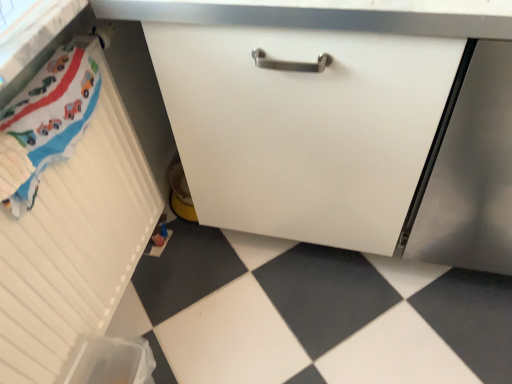
What do you see at coordinates (309, 310) in the screenshot? I see `white glossy tile at lower left` at bounding box center [309, 310].

The width and height of the screenshot is (512, 384). What do you see at coordinates (343, 120) in the screenshot?
I see `white matte cabinet at center, which appears as the 2th cabinetry when viewed from the left` at bounding box center [343, 120].

What do you see at coordinates (469, 171) in the screenshot?
I see `satin silver screen door at lower right` at bounding box center [469, 171].

Locate an element on the screen. white glossy tile at lower left is located at coordinates (309, 310).

Considering the relative sizes of white matte cabinet at center, which ranks as the 1th cabinetry in right-to-left order, and white glossy tile at lower left in the image provided, is white matte cabinet at center, which ranks as the 1th cabinetry in right-to-left order, taller than white glossy tile at lower left?

Indeed, white matte cabinet at center, which ranks as the 1th cabinetry in right-to-left order, has a greater height compared to white glossy tile at lower left.

Between white matte cabinet at center, which ranks as the 1th cabinetry in right-to-left order, and white glossy tile at lower left, which one is positioned behind?

white glossy tile at lower left is further from the camera.

What's the angular difference between white matte cabinet at center, which ranks as the 1th cabinetry in right-to-left order, and white glossy tile at lower left's facing directions?

The angle between the facing direction of white matte cabinet at center, which ranks as the 1th cabinetry in right-to-left order, and the facing direction of white glossy tile at lower left is 89.5 degrees.

From a real-world perspective, is white matte cabinet at center, which ranks as the 1th cabinetry in right-to-left order, under white glossy tile at lower left?

Actually, white matte cabinet at center, which ranks as the 1th cabinetry in right-to-left order, is physically above white glossy tile at lower left in the real world.

From the image's perspective, relative to white matte cabinet at center, which appears as the 2th cabinetry when viewed from the left, is white glossy tile at lower left above or below?

white glossy tile at lower left is situated lower than white matte cabinet at center, which appears as the 2th cabinetry when viewed from the left, in the image.

Can you confirm if white glossy tile at lower left is shorter than white matte cabinet at center, which appears as the 2th cabinetry when viewed from the left?

Yes.

Does white glossy tile at lower left come in front of white matte cabinet at center, which appears as the 2th cabinetry when viewed from the left?

No, white glossy tile at lower left is further to the viewer.

Is white matte cabinet at center, which appears as the 2th cabinetry when viewed from the left, a part of white glossy tile at lower left?

That's incorrect, white matte cabinet at center, which appears as the 2th cabinetry when viewed from the left, is not inside white glossy tile at lower left.

Does point (14, 247) lie behind point (153, 301)?

No, it is not.

From a real-world perspective, is white matte radiator at left, the second cabinetry when ordered from right to left, positioned under white glossy tile at lower left based on gravity?

No.

Is white matte radiator at left, which is the first cabinetry from left to right, inside or outside of white glossy tile at lower left?

white matte radiator at left, which is the first cabinetry from left to right, lies outside white glossy tile at lower left.

Considering the relative sizes of white matte cabinet at center, which ranks as the 1th cabinetry in right-to-left order, and white matte radiator at left, which is the first cabinetry from left to right, in the image provided, is white matte cabinet at center, which ranks as the 1th cabinetry in right-to-left order, shorter than white matte radiator at left, which is the first cabinetry from left to right,?

Incorrect, the height of white matte cabinet at center, which ranks as the 1th cabinetry in right-to-left order, does not fall short of that of white matte radiator at left, which is the first cabinetry from left to right.

From a real-world perspective, between white matte cabinet at center, which appears as the 2th cabinetry when viewed from the left, and white matte radiator at left, the second cabinetry when ordered from right to left, who is vertically lower?

white matte radiator at left, the second cabinetry when ordered from right to left, from a real-world perspective.

In the image, is white matte cabinet at center, which appears as the 2th cabinetry when viewed from the left, positioned in front of or behind white matte radiator at left, which is the first cabinetry from left to right?

Visually, white matte cabinet at center, which appears as the 2th cabinetry when viewed from the left, is located behind white matte radiator at left, which is the first cabinetry from left to right.

Between white matte cabinet at center, which ranks as the 1th cabinetry in right-to-left order, and white matte radiator at left, which is the first cabinetry from left to right, which one appears on the left side from the viewer's perspective?

From the viewer's perspective, white matte radiator at left, which is the first cabinetry from left to right, appears more on the left side.

This screenshot has height=384, width=512. Identify the location of screen door that is on the right side of white glossy tile at lower left. (469, 171).

Is white glossy tile at lower left not inside satin silver screen door at lower right?

Yes, white glossy tile at lower left is outside of satin silver screen door at lower right.

Looking at this image, which object is positioned more to the right, white glossy tile at lower left or satin silver screen door at lower right?

From the viewer's perspective, satin silver screen door at lower right appears more on the right side.

Which of these two, white glossy tile at lower left or white matte radiator at left, the second cabinetry when ordered from right to left, is wider?

Wider between the two is white glossy tile at lower left.

Is point (392, 367) in front of point (147, 100)?

Yes, point (392, 367) is closer to viewer.

Is white glossy tile at lower left positioned far away from white matte radiator at left, the second cabinetry when ordered from right to left?

No, white glossy tile at lower left is not far from white matte radiator at left, the second cabinetry when ordered from right to left.

Is white matte radiator at left, the second cabinetry when ordered from right to left, positioned with its back to satin silver screen door at lower right?

No, satin silver screen door at lower right is not at the back of white matte radiator at left, the second cabinetry when ordered from right to left.

Based on their positions, is white matte radiator at left, the second cabinetry when ordered from right to left, located to the left or right of satin silver screen door at lower right?

From the image, it's evident that white matte radiator at left, the second cabinetry when ordered from right to left, is to the left of satin silver screen door at lower right.

Which is behind, white matte radiator at left, which is the first cabinetry from left to right, or satin silver screen door at lower right?

satin silver screen door at lower right is behind.

Who is smaller, white matte radiator at left, the second cabinetry when ordered from right to left, or satin silver screen door at lower right?

white matte radiator at left, the second cabinetry when ordered from right to left, is smaller.

Where is `tile below the white matte cabinet at center, which ranks as the 1th cabinetry in right-to-left order (from a real-world perspective)`? The width and height of the screenshot is (512, 384). tile below the white matte cabinet at center, which ranks as the 1th cabinetry in right-to-left order (from a real-world perspective) is located at coordinates (309, 310).

Locate an element on the screen. The image size is (512, 384). tile on the right of white matte cabinet at center, which ranks as the 1th cabinetry in right-to-left order is located at coordinates (309, 310).

In the scene shown: Estimate the real-world distances between objects in this image. Which object is further from white matte radiator at left, the second cabinetry when ordered from right to left, satin silver screen door at lower right or white matte cabinet at center, which appears as the 2th cabinetry when viewed from the left?

satin silver screen door at lower right is positioned further to the anchor white matte radiator at left, the second cabinetry when ordered from right to left.

Based on their spatial positions, is white matte radiator at left, which is the first cabinetry from left to right, or satin silver screen door at lower right further from white glossy tile at lower left?

white matte radiator at left, which is the first cabinetry from left to right, is positioned further to the anchor white glossy tile at lower left.

Based on their spatial positions, is white matte radiator at left, the second cabinetry when ordered from right to left, or white matte cabinet at center, which ranks as the 1th cabinetry in right-to-left order, further from white glossy tile at lower left?

The object further to white glossy tile at lower left is white matte radiator at left, the second cabinetry when ordered from right to left.

Consider the image. Considering their positions, is white matte radiator at left, which is the first cabinetry from left to right, positioned closer to satin silver screen door at lower right than white glossy tile at lower left?

Among the two, white glossy tile at lower left is located nearer to satin silver screen door at lower right.

Estimate the real-world distances between objects in this image. Which object is further from white matte radiator at left, the second cabinetry when ordered from right to left, white glossy tile at lower left or satin silver screen door at lower right?

Based on the image, satin silver screen door at lower right appears to be further to white matte radiator at left, the second cabinetry when ordered from right to left.

Looking at the image, which one is located further to white matte cabinet at center, which ranks as the 1th cabinetry in right-to-left order, white matte radiator at left, the second cabinetry when ordered from right to left, or satin silver screen door at lower right?

white matte radiator at left, the second cabinetry when ordered from right to left, lies further to white matte cabinet at center, which ranks as the 1th cabinetry in right-to-left order, than the other object.

Which object lies further to the anchor point white glossy tile at lower left, white matte cabinet at center, which appears as the 2th cabinetry when viewed from the left, or white matte radiator at left, which is the first cabinetry from left to right?

white matte radiator at left, which is the first cabinetry from left to right.

Looking at the image, which one is located closer to white matte cabinet at center, which appears as the 2th cabinetry when viewed from the left, white glossy tile at lower left or satin silver screen door at lower right?

satin silver screen door at lower right.

The height and width of the screenshot is (384, 512). Find the location of `cabinetry situated between white matte radiator at left, which is the first cabinetry from left to right, and satin silver screen door at lower right from left to right`. cabinetry situated between white matte radiator at left, which is the first cabinetry from left to right, and satin silver screen door at lower right from left to right is located at coordinates (343, 120).

You are a GUI agent. You are given a task and a screenshot of the screen. Output one action in this format:
    pyautogui.click(x=<x>, y=<y>)
    Task: Click on the cabinetry between white matte radiator at left, which is the first cabinetry from left to right, and white glossy tile at lower left from left to right
    The image size is (512, 384).
    Given the screenshot: What is the action you would take?
    pyautogui.click(x=343, y=120)

This screenshot has height=384, width=512. Identify the location of tile located between white matte radiator at left, which is the first cabinetry from left to right, and satin silver screen door at lower right in the left-right direction. (309, 310).

At what (x,y) coordinates should I click in order to perform the action: click on tile between white matte cabinet at center, which ranks as the 1th cabinetry in right-to-left order, and satin silver screen door at lower right from left to right. Please return your answer as a coordinate pair (x, y). Looking at the image, I should click on pyautogui.click(x=309, y=310).